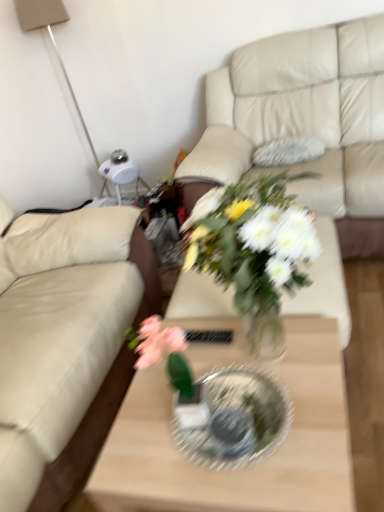
Question: Can you confirm if clear glass coffee table at center is wider than beige leather couch at left, the first studio couch from the left?

Choices:
 (A) yes
 (B) no

Answer: (B)

Question: Are clear glass coffee table at center and beige leather couch at left, the first studio couch from the left, beside each other?

Choices:
 (A) no
 (B) yes

Answer: (A)

Question: Is beige leather couch at left, acting as the second studio couch starting from the right, at the back of clear glass coffee table at center?

Choices:
 (A) yes
 (B) no

Answer: (A)

Question: Does clear glass coffee table at center turn towards beige leather couch at left, the first studio couch from the left?

Choices:
 (A) no
 (B) yes

Answer: (A)

Question: Is clear glass coffee table at center positioned behind beige leather couch at left, the first studio couch from the left?

Choices:
 (A) no
 (B) yes

Answer: (A)

Question: Considering the positions of clear glass plate at center and beige leather couch at left, the first studio couch from the left, in the image, is clear glass plate at center wider or thinner than beige leather couch at left, the first studio couch from the left,?

Choices:
 (A) thin
 (B) wide

Answer: (A)

Question: Considering the positions of point (251, 449) and point (57, 464), is point (251, 449) closer or farther from the camera than point (57, 464)?

Choices:
 (A) closer
 (B) farther

Answer: (A)

Question: From the image's perspective, is clear glass plate at center located above or below beige leather couch at left, acting as the second studio couch starting from the right?

Choices:
 (A) below
 (B) above

Answer: (A)

Question: Is clear glass plate at center to the left or to the right of beige leather couch at left, the first studio couch from the left, in the image?

Choices:
 (A) left
 (B) right

Answer: (B)

Question: Is beige leather couch at upper center, which is counted as the 1th studio couch, starting from the right, in front of or behind clear glass coffee table at center in the image?

Choices:
 (A) front
 (B) behind

Answer: (B)

Question: Is point (302, 32) closer or farther from the camera than point (196, 350)?

Choices:
 (A) farther
 (B) closer

Answer: (A)

Question: Is beige leather couch at upper center, which is counted as the 1th studio couch, starting from the right, inside the boundaries of clear glass coffee table at center, or outside?

Choices:
 (A) outside
 (B) inside

Answer: (A)

Question: From the image's perspective, relative to clear glass coffee table at center, is beige leather couch at upper center, which is counted as the 1th studio couch, starting from the right, above or below?

Choices:
 (A) below
 (B) above

Answer: (B)

Question: Is clear glass coffee table at center in front of or behind beige leather couch at left, acting as the second studio couch starting from the right, in the image?

Choices:
 (A) behind
 (B) front

Answer: (B)

Question: From the image's perspective, relative to beige leather couch at left, the first studio couch from the left, is clear glass coffee table at center above or below?

Choices:
 (A) below
 (B) above

Answer: (A)